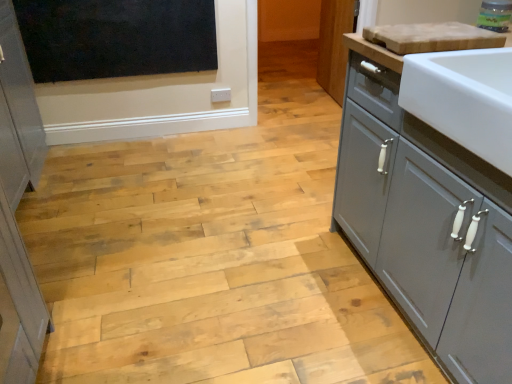
The height and width of the screenshot is (384, 512). I want to click on free point below matte gray cabinet at right (from a real-world perspective), so click(321, 91).